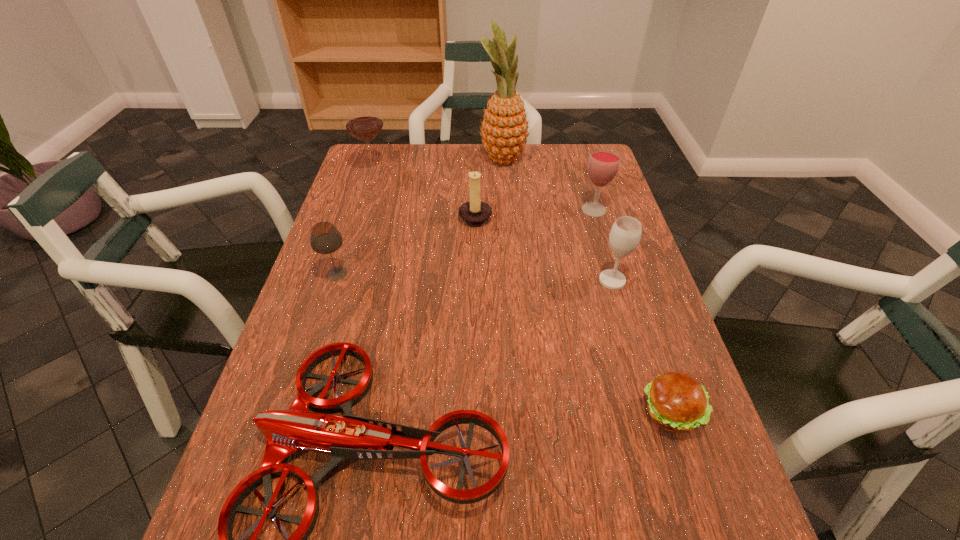
Where is `blank space located 0.120m on the back of the shortest wineglass`? The width and height of the screenshot is (960, 540). blank space located 0.120m on the back of the shortest wineglass is located at coordinates (349, 234).

This screenshot has height=540, width=960. What are the coordinates of `vacant space located on the back of the hamburger` in the screenshot? It's located at (625, 275).

Identify the location of pineapple located at the far edge. [504, 128].

At what (x,y) coordinates should I click in order to perform the action: click on wineglass that is at the far edge. Please return your answer as a coordinate pair (x, y). The image size is (960, 540). Looking at the image, I should click on (363, 121).

You are a GUI agent. You are given a task and a screenshot of the screen. Output one action in this format:
    pyautogui.click(x=<x>, y=<y>)
    Task: Click on the hamburger located at the right edge
    
    Given the screenshot: What is the action you would take?
    pyautogui.click(x=677, y=403)

Locate an element on the screen. Image resolution: width=960 pixels, height=540 pixels. object that is at the far left corner is located at coordinates (363, 121).

In the image, there is a desktop. At what (x,y) coordinates should I click in order to perform the action: click on vacant area at the far edge. Please return your answer as a coordinate pair (x, y). This screenshot has height=540, width=960. Looking at the image, I should click on (454, 150).

In the image, there is a desktop. In order to click on vacant space at the left edge in this screenshot , I will do `click(316, 413)`.

Image resolution: width=960 pixels, height=540 pixels. What are the coordinates of `free spot at the right edge of the desktop` in the screenshot? It's located at (624, 413).

This screenshot has width=960, height=540. In the image, there is a desktop. What are the coordinates of `free space at the far left corner` in the screenshot? It's located at (362, 151).